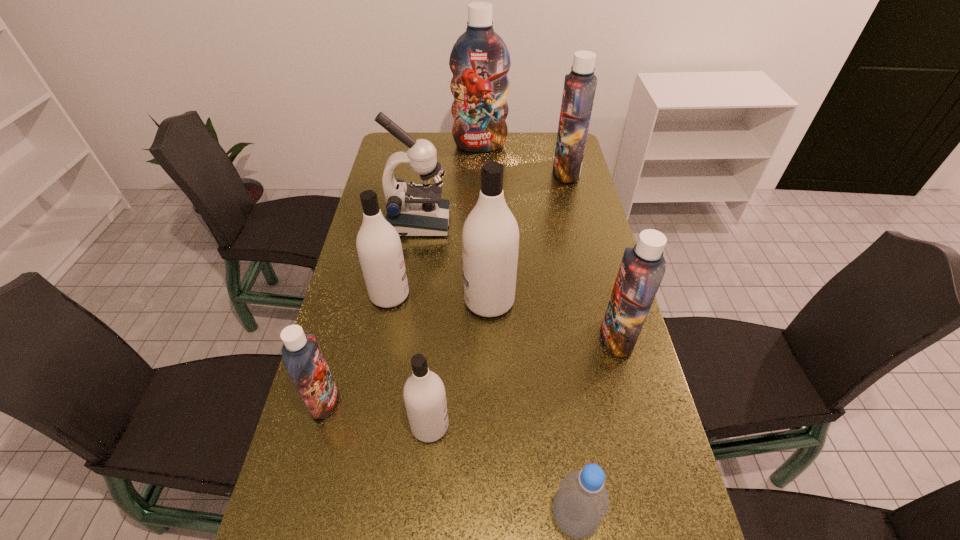
This screenshot has height=540, width=960. Find the location of `the leftmost blue shampoo`. the leftmost blue shampoo is located at coordinates (303, 359).

The image size is (960, 540). I want to click on the second white shampoo from right to left, so click(424, 393).

Find the location of a particular element. the nearest white shampoo is located at coordinates (424, 393).

The height and width of the screenshot is (540, 960). In order to click on free space located on the front label of the tallest shampoo in this screenshot , I will do `click(480, 188)`.

This screenshot has width=960, height=540. In order to click on free space located on the front-facing side of the rightmost white shampoo in this screenshot , I will do `click(361, 301)`.

This screenshot has height=540, width=960. In order to click on free space located on the front-facing side of the rightmost white shampoo in this screenshot , I will do `click(406, 301)`.

Find the location of a particular element. blank space located 0.320m on the front-facing side of the rightmost white shampoo is located at coordinates (354, 301).

Locate an element on the screen. The width and height of the screenshot is (960, 540). vacant space located 0.280m on the front label of the second farthest shampoo is located at coordinates click(483, 172).

This screenshot has width=960, height=540. I want to click on free space located on the front label of the second farthest shampoo, so click(520, 172).

This screenshot has height=540, width=960. Find the location of `vacant space located 0.170m on the front label of the second farthest shampoo`. vacant space located 0.170m on the front label of the second farthest shampoo is located at coordinates (510, 172).